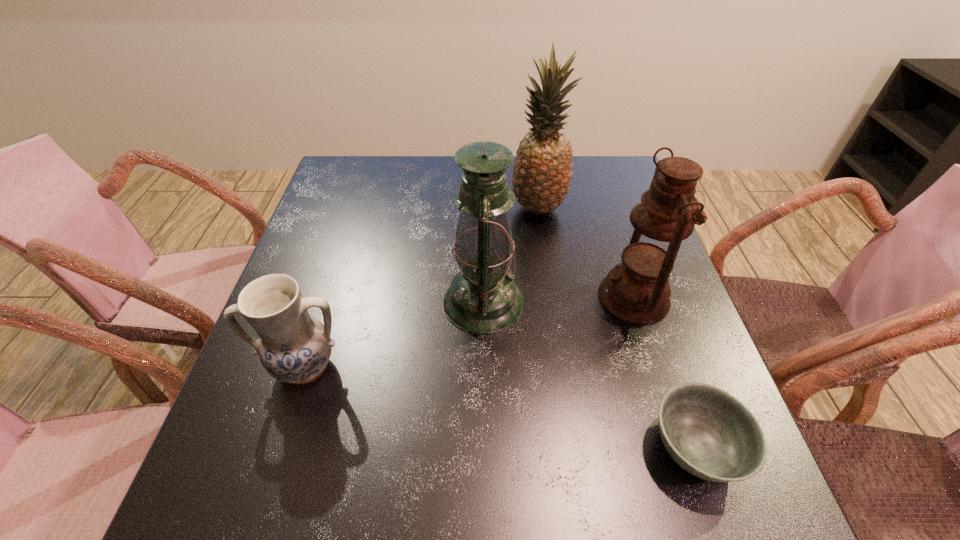
At what (x,y) coordinates should I click in order to perform the action: click on vacant space located on the left of the right oil lamp. Please return your answer as a coordinate pair (x, y). Looking at the image, I should click on (x=571, y=298).

You are a GUI agent. You are given a task and a screenshot of the screen. Output one action in this format:
    pyautogui.click(x=<x>, y=<y>)
    Task: Click on the vacant region located 0.350m on the right of the second nearest object
    The image size is (960, 540).
    Given the screenshot: What is the action you would take?
    pyautogui.click(x=531, y=367)

What are the coordinates of `free location located on the left of the nearest object` in the screenshot? It's located at (516, 448).

Locate an element on the screen. object that is positioned at the far edge is located at coordinates (542, 171).

The image size is (960, 540). Find the location of `object that is at the near edge`. object that is at the near edge is located at coordinates (708, 432).

This screenshot has width=960, height=540. I want to click on object present at the left edge, so tap(294, 347).

The image size is (960, 540). Find the location of `oil lamp present at the right edge`. oil lamp present at the right edge is located at coordinates (637, 290).

I want to click on bowl situated at the right edge, so click(x=708, y=432).

I want to click on object located at the near right corner, so click(x=708, y=432).

This screenshot has height=540, width=960. In the image, there is a desktop. What are the coordinates of `vacant space at the far edge` in the screenshot? It's located at (436, 195).